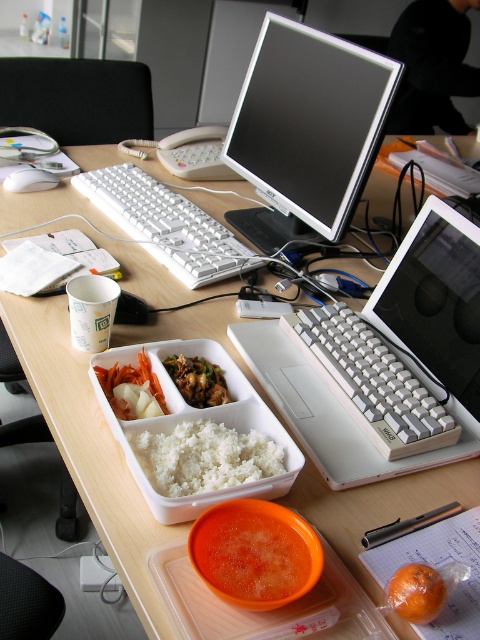
Question: Which point is closer to the camera?

Choices:
 (A) (368, 388)
 (B) (201, 477)

Answer: (B)

Question: Observing the image, what is the correct spatial positioning of white plastic keyboard at center in reference to brown glossy meat at center?

Choices:
 (A) right
 (B) left

Answer: (B)

Question: Is white plastic laptop at center to the left of matte black monitor at center from the viewer's perspective?

Choices:
 (A) yes
 (B) no

Answer: (B)

Question: Which of the following is the farthest from the observer?

Choices:
 (A) (392, 317)
 (B) (110, 196)
 (C) (176, 360)

Answer: (B)

Question: Estimate the real-world distances between objects in this image. Which object is closer to the white matte rice at center?

Choices:
 (A) matte black monitor at center
 (B) brown glossy meat at center

Answer: (B)

Question: Is white plastic laptop at center closer to camera compared to white plastic keyboard at center?

Choices:
 (A) yes
 (B) no

Answer: (A)